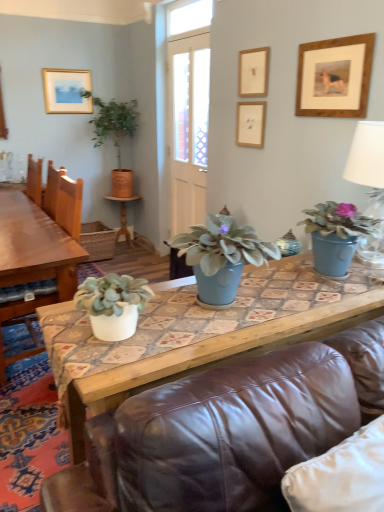
Question: From their relative heights in the image, would you say matte blue pot at center, the 3th houseplant positioned from the top, is taller or shorter than matte blue vase at center, placed as the first coffee table when sorted from front to back?

Choices:
 (A) tall
 (B) short

Answer: (B)

Question: In the image, is matte blue pot at center, marked as the second houseplant in a bottom-to-top arrangement, positioned in front of or behind matte blue vase at center, which is counted as the 2th coffee table, starting from the back?

Choices:
 (A) behind
 (B) front

Answer: (A)

Question: Which is nearer to the white ceramic lamp at upper right?

Choices:
 (A) white matte plant pot at lower left, the 3th houseplant when ordered from right to left
 (B) green leafy plant in terracotta pot at upper left, placed as the 4th houseplant when sorted from bottom to top
 (C) matte gold picture frame at upper left, positioned as the first picture frame in back-to-front order
 (D) wooden picture frame at upper center, acting as the second picture frame starting from the back
 (E) wooden picture frame at upper right, the fourth picture frame positioned from the back

Answer: (E)

Question: Estimate the real-world distances between objects in this image. Which object is farther from the matte blue vase at center, which is counted as the 2th coffee table, starting from the back?

Choices:
 (A) white glossy coffee table at left, which is the second coffee table in right-to-left order
 (B) white ceramic lamp at upper right
 (C) matte gold picture frame at upper left, the 1th picture frame viewed from the left
 (D) matte blue pot at right, positioned as the 3th houseplant in bottom-to-top order
 (E) wooden picture frame at upper center, which is the 3th picture frame in back-to-front order

Answer: (C)